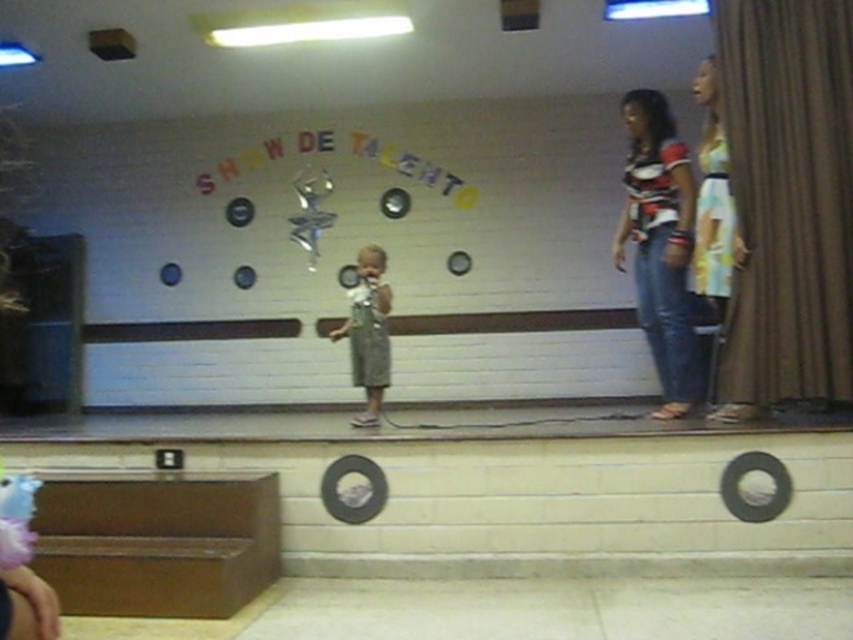
Question: Which of the following is the farthest from the observer?

Choices:
 (A) (352, 372)
 (B) (723, 248)

Answer: (A)

Question: Which point is farther from the camera taking this photo?

Choices:
 (A) (363, 301)
 (B) (665, 291)

Answer: (A)

Question: Which point is closer to the camera taking this photo?

Choices:
 (A) (711, 196)
 (B) (390, 307)

Answer: (A)

Question: Is striped fabric shirt at right positioned behind green fabric dress at center?

Choices:
 (A) yes
 (B) no

Answer: (B)

Question: In this image, where is yellow floral dress at right located relative to green fabric dress at center?

Choices:
 (A) right
 (B) left

Answer: (A)

Question: Does striped fabric shirt at right have a smaller size compared to yellow floral dress at right?

Choices:
 (A) no
 (B) yes

Answer: (A)